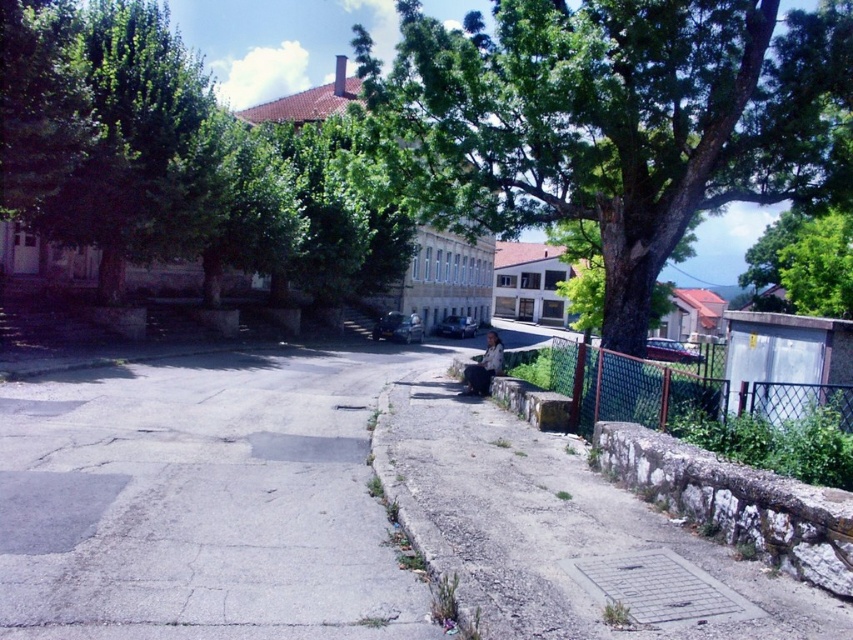
You are standing at the camera position observing the quiet street scene. There are two points marked in the image, point 1 at coordinates point (254, 566) and point 2 at coordinates point (671, 234). Which point is closer to you?

Point (254, 566) is closer to the camera than point (671, 234).

You are a delivery person trying to navigate a narrow path between the gray concrete pavement at center and the green mesh fence at lower right. Which direction should you move to stay on the correct path?

The gray concrete pavement at center is positioned on the left side of the green mesh fence at lower right, so you should move towards the left side of the green mesh fence at lower right to stay on the correct path.

You are a delivery person trying to determine the best path to avoid the green mesh fence at lower right while approaching the green leafy tree at center. Based on their positions, which direction should you move relative to the fence?

The green leafy tree at center is located above the green mesh fence at lower right, so you should move towards the upper direction relative to the fence to reach the tree without hitting the fence.